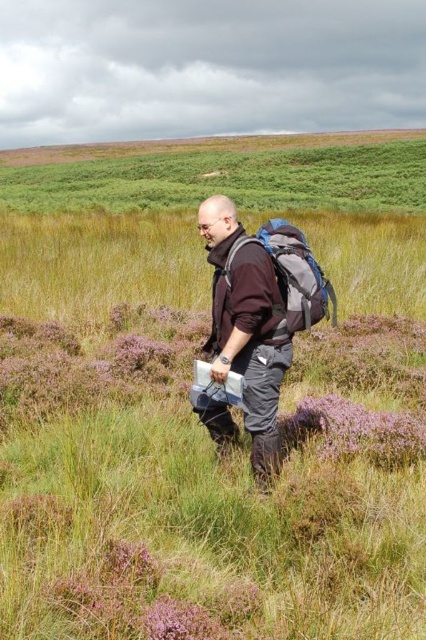
Is matte black jacket at center positioned in front of matte gray backpack at center?

Yes.

Between matte black jacket at center and matte gray backpack at center, which one is positioned higher?

matte gray backpack at center is above.

Between point (219, 406) and point (259, 240), which one is positioned in front?

Point (259, 240) is in front.

Find the location of a particular element. This screenshot has width=426, height=640. matte black jacket at center is located at coordinates (247, 326).